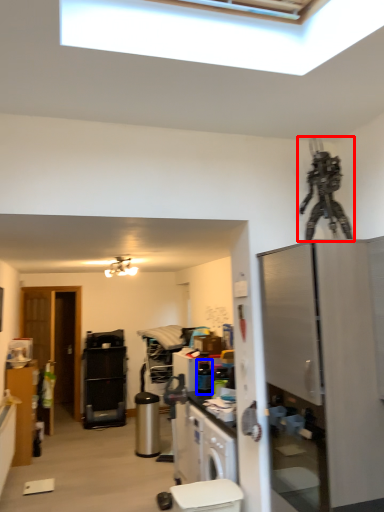
Question: Which point is further to the camera, toy (highlighted by a red box) or appliance (highlighted by a blue box)?

Choices:
 (A) toy
 (B) appliance

Answer: (B)